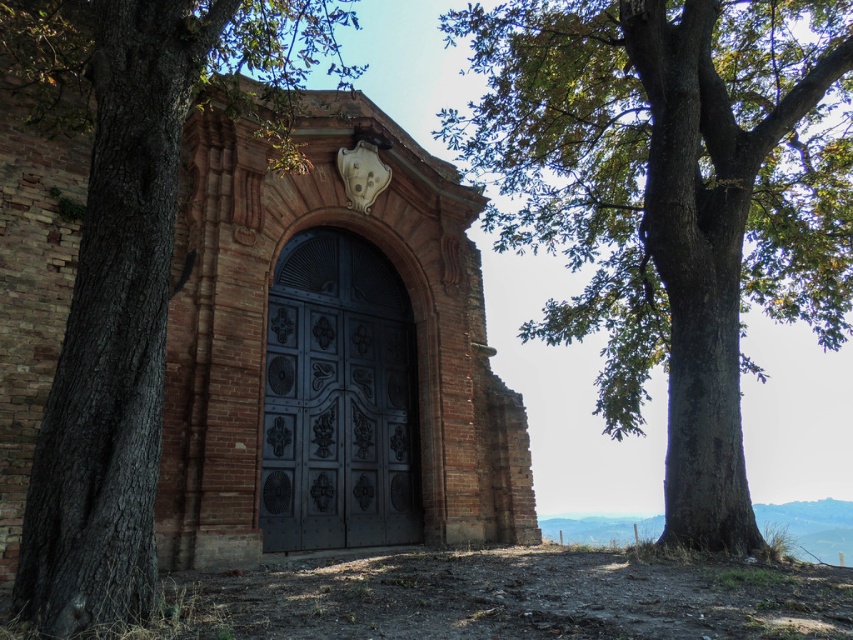
Is green leafy tree at center behind brown rough bark tree at left?

Yes, green leafy tree at center is behind brown rough bark tree at left.

Can you confirm if green leafy tree at center is positioned to the left of brown rough bark tree at left?

Incorrect, green leafy tree at center is not on the left side of brown rough bark tree at left.

Is point (677, 500) closer to camera compared to point (241, 61)?

That is False.

This screenshot has width=853, height=640. I want to click on green leafy tree at center, so 672,198.

Is green leafy tree at center thinner than dark metal door at center?

Correct, green leafy tree at center's width is less than dark metal door at center's.

Who is taller, green leafy tree at center or dark metal door at center?

dark metal door at center

Which is behind, point (614, 196) or point (335, 356)?

The point (614, 196) is behind.

Where is `green leafy tree at center`? green leafy tree at center is located at coordinates [x=672, y=198].

From the picture: Is brown rough bark tree at left smaller than dark metal door at center?

Yes, brown rough bark tree at left is smaller than dark metal door at center.

Between point (76, 410) and point (316, 534), which one is positioned behind?

Point (316, 534)

Identify the location of brown rough bark tree at left. (131, 259).